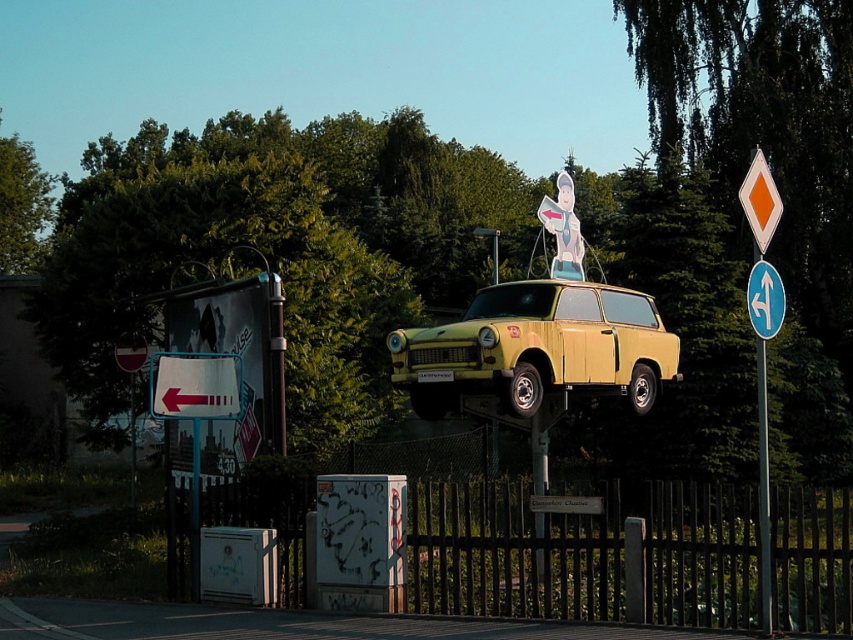
You are standing at the origin point of the image. Where is the metallic pole at center located in terms of coordinates?

The metallic pole at center is located at coordinates point (x=763, y=492).

You are a delivery person trying to navigate through the area and see the metallic pole at center and the blue plastic arrow at upper center. Which object is higher up in the sky?

The metallic pole at center is taller than the blue plastic arrow at upper center, so the metallic pole at center is higher up in the sky.